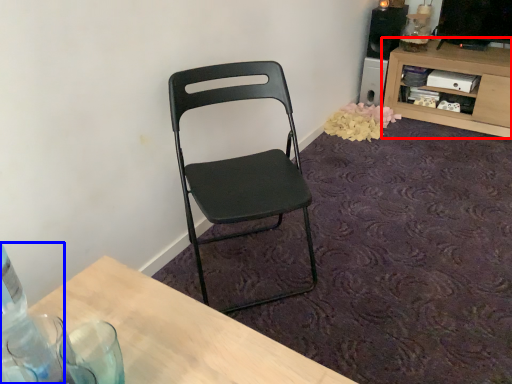
Question: Which of the following is the closest to the observer, shelf (highlighted by a red box) or bottle (highlighted by a blue box)?

Choices:
 (A) shelf
 (B) bottle

Answer: (B)